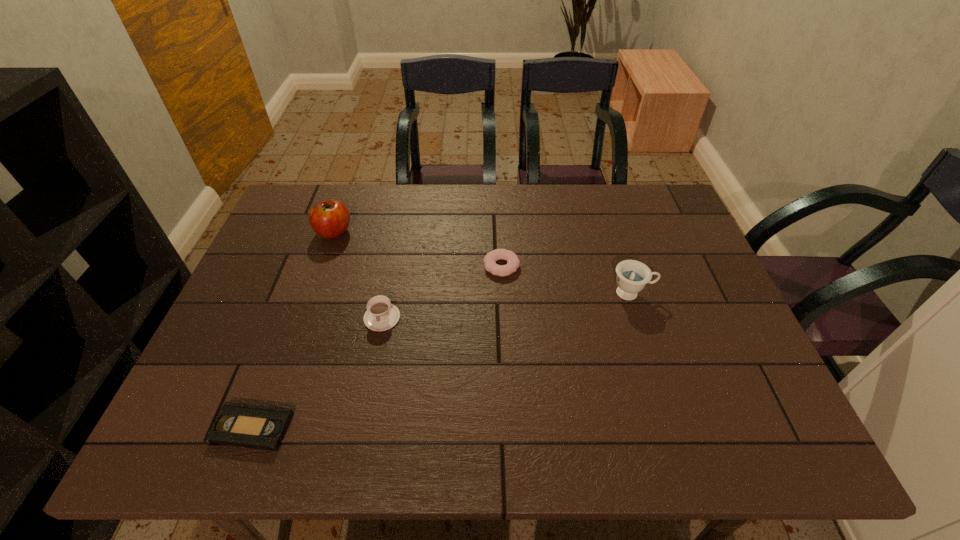
Identify the location of apple. Image resolution: width=960 pixels, height=540 pixels. click(329, 219).

I want to click on the tallest object, so click(329, 219).

Find the location of a particular element. This screenshot has height=540, width=960. the taller teacup is located at coordinates (632, 276).

At what (x,y) coordinates should I click in order to perform the action: click on the right teacup. Please return your answer as a coordinate pair (x, y). Looking at the image, I should click on (632, 276).

In order to click on the third object from left to right in this screenshot , I will do `click(381, 315)`.

Where is `the third tallest object`? Image resolution: width=960 pixels, height=540 pixels. the third tallest object is located at coordinates (381, 315).

Find the location of a particular element. The height and width of the screenshot is (540, 960). doughnut is located at coordinates (513, 262).

The width and height of the screenshot is (960, 540). I want to click on the second shortest object, so click(513, 262).

Locate an element on the screen. This screenshot has width=960, height=540. videotape is located at coordinates (243, 425).

Image resolution: width=960 pixels, height=540 pixels. What are the coordinates of `the nearest object` in the screenshot? It's located at (243, 425).